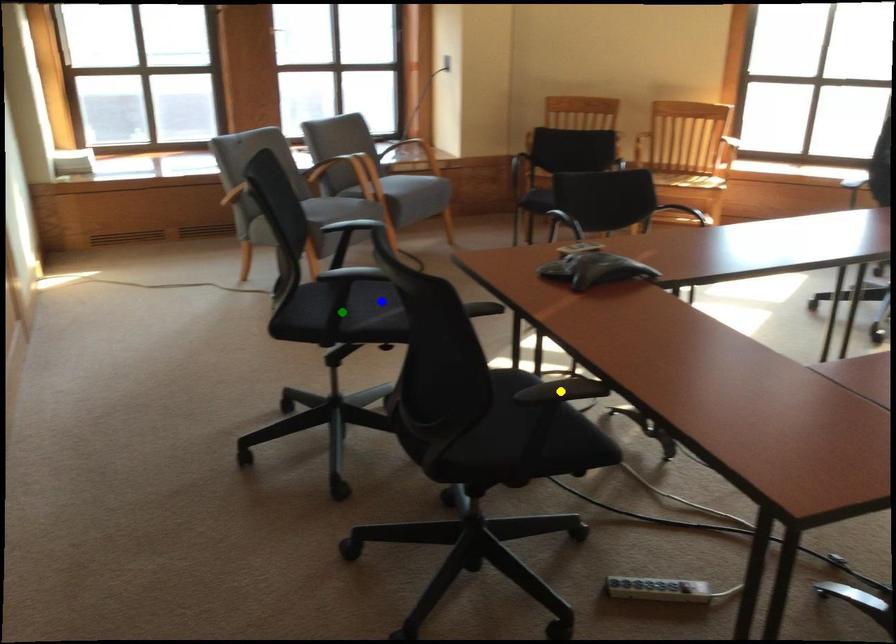
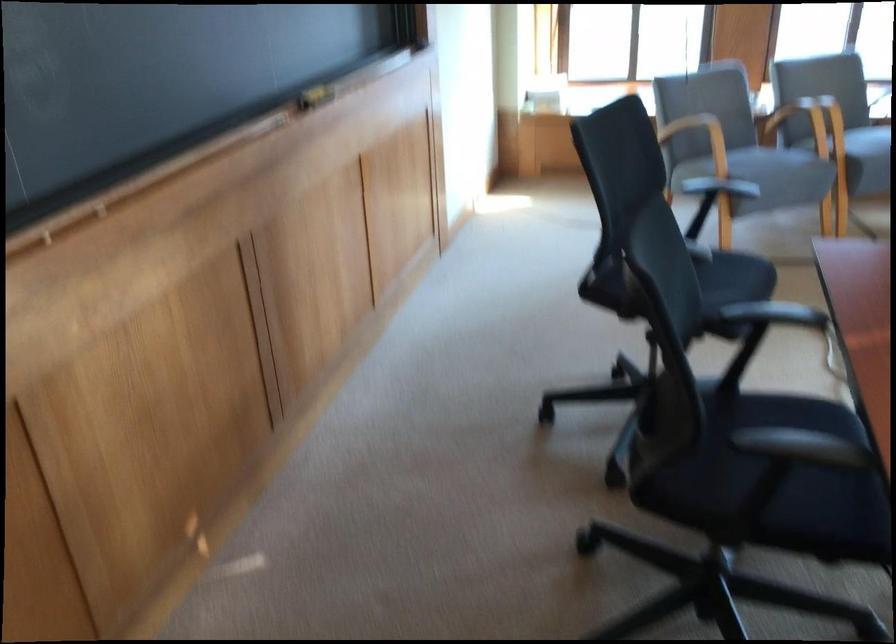
I am providing you with two images of the same scene from different viewpoints. Three points are marked in image1. Which point corresponds to a part or object that is occluded in image2?In image1, three points are marked. Which of them correspond to a part or object that is occluded in image2?Among the three points shown in image1, which one corresponds to a part or object that is no longer visible due to occlusion in image2?

green point, yellow point cannot be seen in image2.